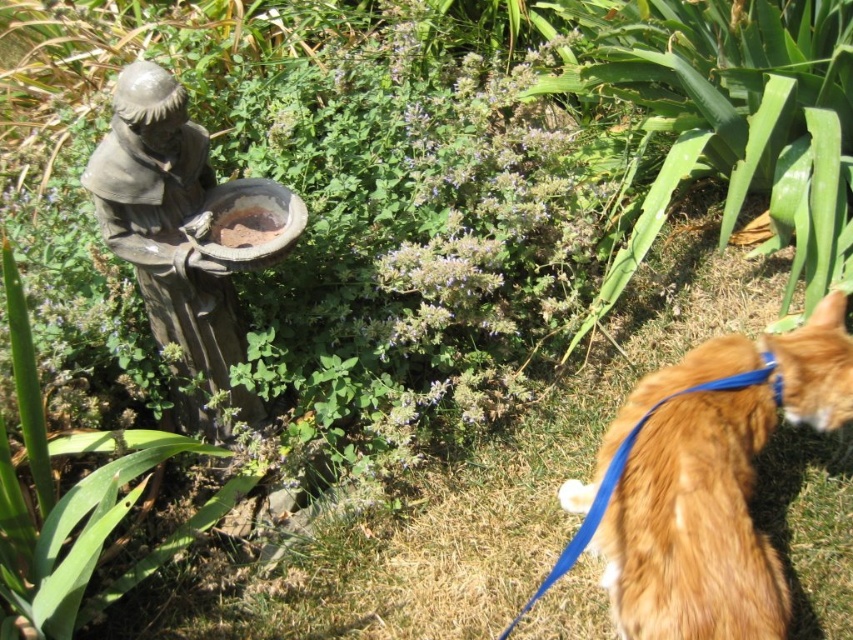
Question: Observing the image, what is the correct spatial positioning of gray stone statue at upper left in reference to matte brown bowl at center?

Choices:
 (A) above
 (B) below

Answer: (B)

Question: Does gray stone statue at upper left have a larger size compared to matte brown bowl at center?

Choices:
 (A) yes
 (B) no

Answer: (A)

Question: Among these points, which one is nearest to the camera?

Choices:
 (A) (155, 220)
 (B) (216, 228)

Answer: (A)

Question: Among these points, which one is farthest from the camera?

Choices:
 (A) (228, 237)
 (B) (743, 508)
 (C) (196, 212)

Answer: (A)

Question: Which is farther from the orange fur at lower right?

Choices:
 (A) gray stone statue at upper left
 (B) matte brown bowl at center

Answer: (B)

Question: Does gray stone statue at upper left appear under matte brown bowl at center?

Choices:
 (A) no
 (B) yes

Answer: (B)